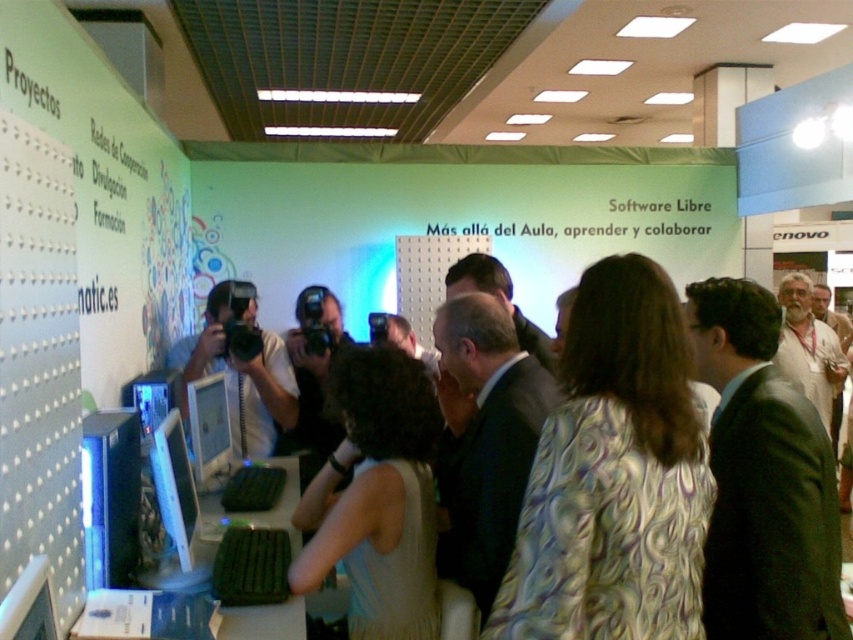
You are an attendee at this tech event. You want to take a photo of both the matte white monitor at center and the matte black monitor at lower left. Which monitor should you focus on first to ensure both are in the frame?

You should focus on the matte white monitor at center first because it is closer to you than the matte black monitor at lower left, so by focusing on it, both monitors will be in the frame.

You are standing at the entrance of the conference hall and see the matte black monitor at center. If you walk straight towards it, will you encounter any obstacles in your path?

The matte black monitor at center is located at point (173, 484) in 2D space. Since the path is clear in front of you, you can walk straight towards it without encountering any obstacles.

You are a photographer standing in the middle of the conference hall. You want to take a photo of the crowd without moving. Can you capture the entire crowd in your shot using the matte black camera at center?

The matte black camera at center is 3.17 meters away from the viewer. Since the camera is positioned at that distance, it is possible to capture the entire crowd in the shot without moving, assuming the camera has a wide enough lens to encompass the crowd spread in front of it.